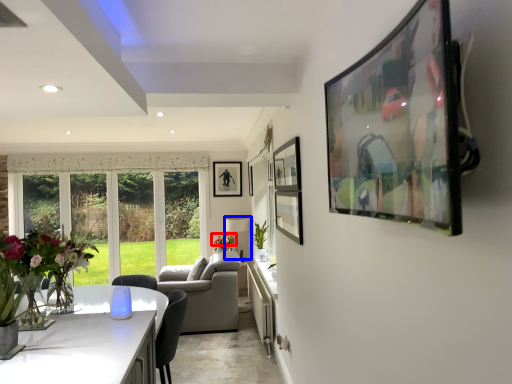
Question: Among these objects, which one is nearest to the camera, flower (highlighted by a red box) or lamp (highlighted by a blue box)?

Choices:
 (A) flower
 (B) lamp

Answer: (A)